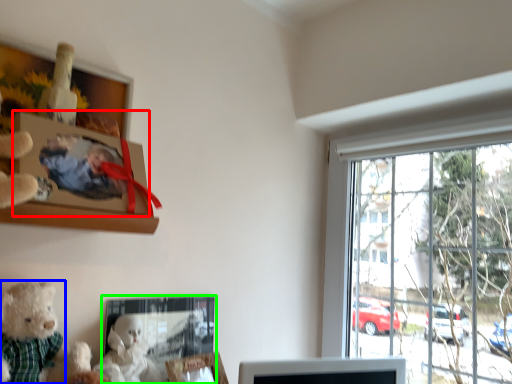
Question: Based on their relative distances, which object is nearer to picture frame (highlighted by a red box)? Choose from teddy bear (highlighted by a blue box) and picture frame (highlighted by a green box).

Choices:
 (A) teddy bear
 (B) picture frame

Answer: (A)